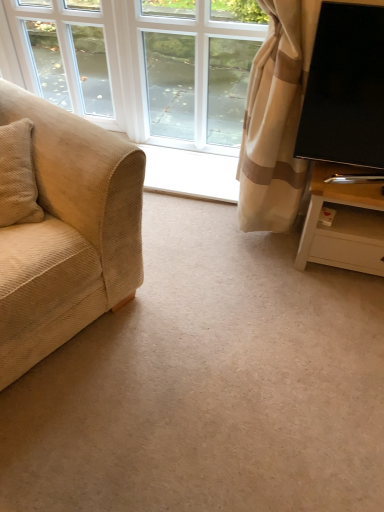
Question: Should I look upward or downward to see beige corduroy couch at left?

Choices:
 (A) down
 (B) up

Answer: (B)

Question: Is white glass window at upper left, positioned as the first window in left-to-right order, far from white glass window at center, the 2th window positioned from the left?

Choices:
 (A) no
 (B) yes

Answer: (B)

Question: Does white glass window at upper left, which is counted as the second window, starting from the right, have a lesser width compared to white glass window at center, the 2th window positioned from the left?

Choices:
 (A) no
 (B) yes

Answer: (A)

Question: Can you confirm if white glass window at upper left, which is counted as the second window, starting from the right, is positioned to the right of white glass window at center, the 2th window positioned from the left?

Choices:
 (A) no
 (B) yes

Answer: (A)

Question: Does white glass window at upper left, positioned as the first window in left-to-right order, have a lesser height compared to white glass window at center, the 2th window positioned from the left?

Choices:
 (A) yes
 (B) no

Answer: (A)

Question: Is white glass window at upper left, which is counted as the second window, starting from the right, positioned before white glass window at center, the 2th window positioned from the left?

Choices:
 (A) no
 (B) yes

Answer: (A)

Question: From a real-world perspective, is white glass window at upper left, positioned as the first window in left-to-right order, over white glass window at center, the 1th window viewed from the right?

Choices:
 (A) no
 (B) yes

Answer: (B)

Question: From a real-world perspective, is white glass window at center, the 1th window viewed from the right, located beneath white glass window at upper left, which is counted as the second window, starting from the right?

Choices:
 (A) no
 (B) yes

Answer: (B)

Question: Is white glass window at center, the 2th window positioned from the left, taller than white glass window at upper left, positioned as the first window in left-to-right order?

Choices:
 (A) yes
 (B) no

Answer: (A)

Question: Would you say white glass window at center, the 2th window positioned from the left, contains white glass window at upper left, which is counted as the second window, starting from the right?

Choices:
 (A) yes
 (B) no

Answer: (B)

Question: Does white glass window at center, the 2th window positioned from the left, have a lesser width compared to white glass window at upper left, which is counted as the second window, starting from the right?

Choices:
 (A) no
 (B) yes

Answer: (B)

Question: Can you confirm if white glass window at center, the 2th window positioned from the left, is bigger than white glass window at upper left, positioned as the first window in left-to-right order?

Choices:
 (A) no
 (B) yes

Answer: (A)

Question: Is white glass window at center, the 2th window positioned from the left, not close to white glass window at upper left, which is counted as the second window, starting from the right?

Choices:
 (A) no
 (B) yes

Answer: (B)

Question: Is white wood tv stand at right smaller than white glass window at center, the 1th window viewed from the right?

Choices:
 (A) no
 (B) yes

Answer: (A)